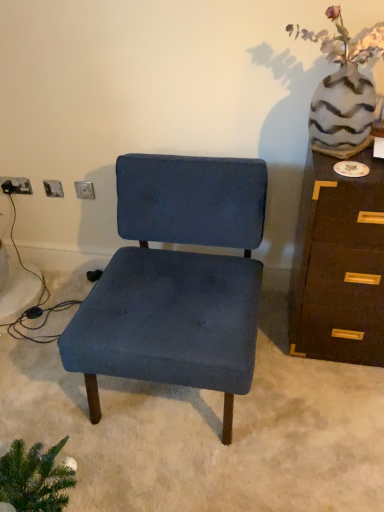
Question: Does matte silver outlet at lower left, the second electric outlet viewed from the right, appear on the left side of speckled ceramic vase at upper right?

Choices:
 (A) yes
 (B) no

Answer: (A)

Question: From the image's perspective, is matte silver outlet at lower left, acting as the 2th electric outlet starting from the front, located beneath speckled ceramic vase at upper right?

Choices:
 (A) no
 (B) yes

Answer: (B)

Question: From the image's perspective, is matte silver outlet at lower left, the second electric outlet viewed from the right, located above speckled ceramic vase at upper right?

Choices:
 (A) yes
 (B) no

Answer: (B)

Question: Is matte silver outlet at lower left, the second electric outlet viewed from the right, far from speckled ceramic vase at upper right?

Choices:
 (A) yes
 (B) no

Answer: (A)

Question: From a real-world perspective, is matte silver outlet at lower left, acting as the 2th electric outlet starting from the front, over speckled ceramic vase at upper right?

Choices:
 (A) no
 (B) yes

Answer: (A)

Question: Is brown wood chest of drawers at right situated inside speckled ceramic vase at upper right or outside?

Choices:
 (A) inside
 (B) outside

Answer: (B)

Question: Looking at their shapes, would you say brown wood chest of drawers at right is wider or thinner than speckled ceramic vase at upper right?

Choices:
 (A) wide
 (B) thin

Answer: (A)

Question: From the image's perspective, is brown wood chest of drawers at right located above or below speckled ceramic vase at upper right?

Choices:
 (A) above
 (B) below

Answer: (B)

Question: From a real-world perspective, is brown wood chest of drawers at right physically located above or below speckled ceramic vase at upper right?

Choices:
 (A) above
 (B) below

Answer: (B)

Question: From their relative heights in the image, would you say metallic silver electric outlet at upper left, which is counted as the 2th electric outlet, starting from the back, is taller or shorter than brown wood chest of drawers at right?

Choices:
 (A) tall
 (B) short

Answer: (B)

Question: Does point (82, 196) appear closer or farther from the camera than point (359, 355)?

Choices:
 (A) closer
 (B) farther

Answer: (B)

Question: From a real-world perspective, relative to brown wood chest of drawers at right, is metallic silver electric outlet at upper left, which is counted as the 2th electric outlet, starting from the back, vertically above or below?

Choices:
 (A) above
 (B) below

Answer: (A)

Question: Visually, is metallic silver electric outlet at upper left, the 1th electric outlet when ordered from front to back, positioned to the left or to the right of brown wood chest of drawers at right?

Choices:
 (A) left
 (B) right

Answer: (A)

Question: Visually, is velvet blue chair at center positioned to the left or to the right of matte silver outlet at lower left, arranged as the 1th electric outlet when viewed from the left?

Choices:
 (A) right
 (B) left

Answer: (A)

Question: From the image's perspective, is velvet blue chair at center positioned above or below matte silver outlet at lower left, arranged as the 1th electric outlet when viewed from the left?

Choices:
 (A) below
 (B) above

Answer: (A)